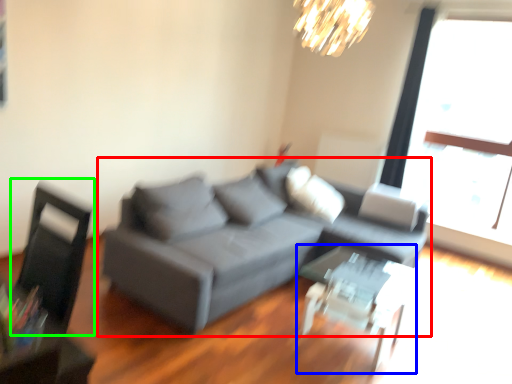
Question: Estimate the real-world distances between objects in this image. Which object is closer to studio couch (highlighted by a red box), table (highlighted by a blue box) or swivel chair (highlighted by a green box)?

Choices:
 (A) table
 (B) swivel chair

Answer: (A)